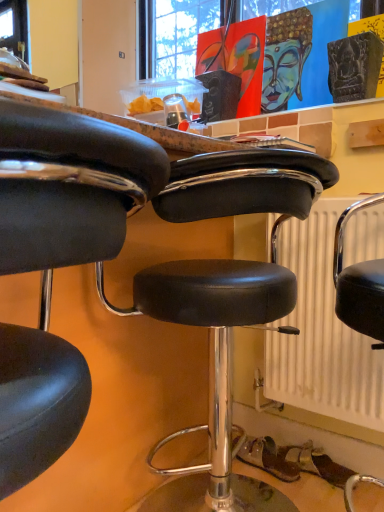
Question: Is black leather stool at center, which ranks as the first chair in front-to-back order, oriented towards black leather stool at center, arranged as the second chair when viewed from the front?

Choices:
 (A) no
 (B) yes

Answer: (A)

Question: From the image's perspective, would you say black leather stool at center, placed as the 2th chair when sorted from back to front, is shown under black leather stool at center, arranged as the second chair when viewed from the front?

Choices:
 (A) no
 (B) yes

Answer: (A)

Question: Is black leather stool at center, arranged as the second chair when viewed from the front, inside black leather stool at center, placed as the 2th chair when sorted from back to front?

Choices:
 (A) no
 (B) yes

Answer: (A)

Question: Would you consider black leather stool at center, which ranks as the first chair in front-to-back order, to be distant from black leather stool at center, arranged as the second chair when viewed from the front?

Choices:
 (A) no
 (B) yes

Answer: (A)

Question: Can you confirm if black leather stool at center, placed as the 2th chair when sorted from back to front, is bigger than black leather stool at center, arranged as the second chair when viewed from the front?

Choices:
 (A) yes
 (B) no

Answer: (B)

Question: Can you confirm if black leather stool at center, placed as the 2th chair when sorted from back to front, is wider than black leather stool at center, the 1th chair from the back?

Choices:
 (A) yes
 (B) no

Answer: (A)

Question: Is white textured radiator at center shorter than black leather stool at center, placed as the 2th chair when sorted from back to front?

Choices:
 (A) yes
 (B) no

Answer: (B)

Question: Considering the relative sizes of white textured radiator at center and black leather stool at center, which ranks as the first chair in front-to-back order, in the image provided, is white textured radiator at center thinner than black leather stool at center, which ranks as the first chair in front-to-back order,?

Choices:
 (A) no
 (B) yes

Answer: (B)

Question: Is white textured radiator at center closer to camera compared to black leather stool at center, placed as the 2th chair when sorted from back to front?

Choices:
 (A) no
 (B) yes

Answer: (A)

Question: From a real-world perspective, does white textured radiator at center stand above black leather stool at center, which ranks as the first chair in front-to-back order?

Choices:
 (A) yes
 (B) no

Answer: (B)

Question: Does white textured radiator at center turn towards black leather stool at center, which ranks as the first chair in front-to-back order?

Choices:
 (A) no
 (B) yes

Answer: (A)

Question: Does white textured radiator at center have a greater width compared to black leather stool at center, placed as the 2th chair when sorted from back to front?

Choices:
 (A) yes
 (B) no

Answer: (B)

Question: Does white textured radiator at center have a lesser height compared to black leather stool at center, the 1th chair from the back?

Choices:
 (A) no
 (B) yes

Answer: (A)